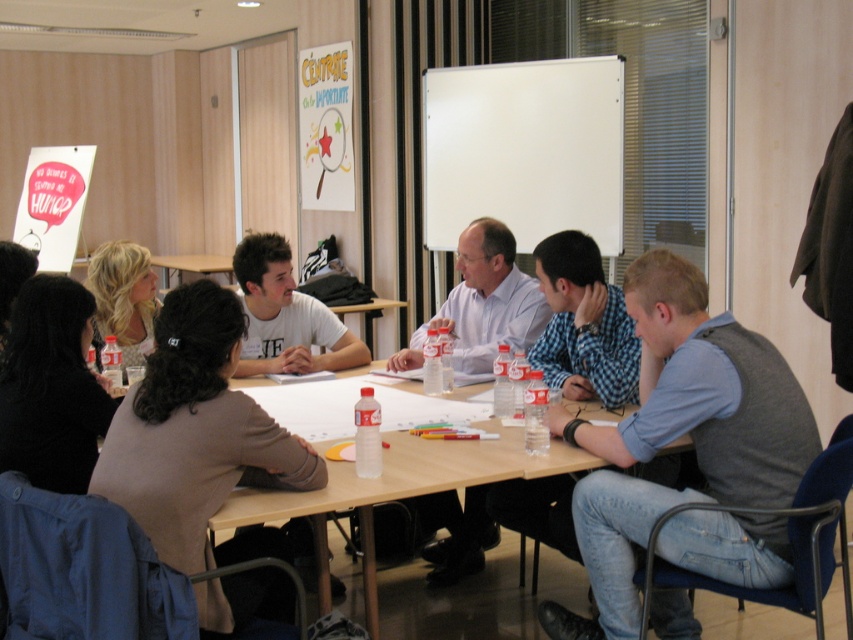
You are standing in the conference room and want to place a 2.5 feet wide laptop bag on the table without moving any participants. Is there enough space between you and the table at point (x=598, y=586) to place it?

The distance between you and the table at point (x=598, y=586) is 7.48 feet, which is more than enough to place a 2.5 feet wide laptop bag without needing to move anyone.